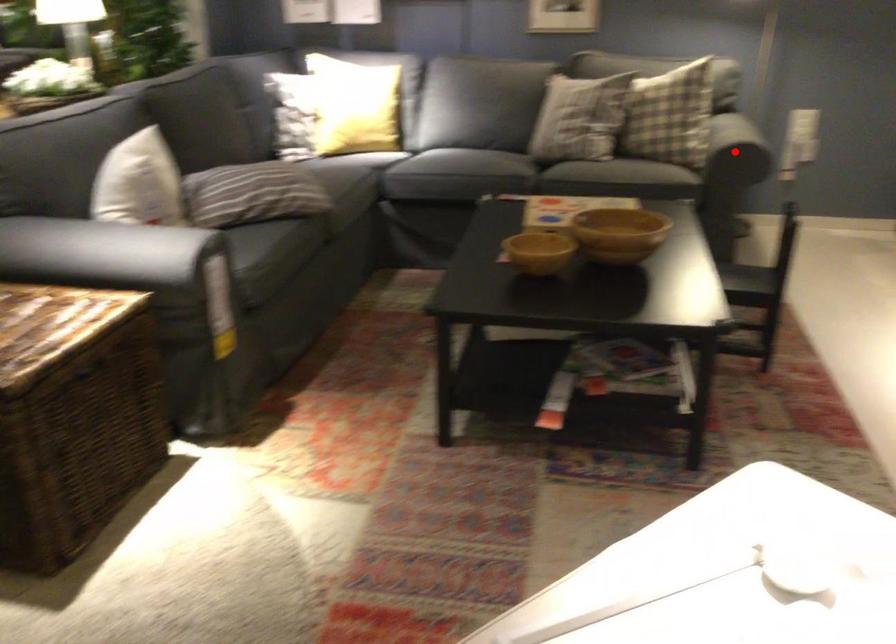
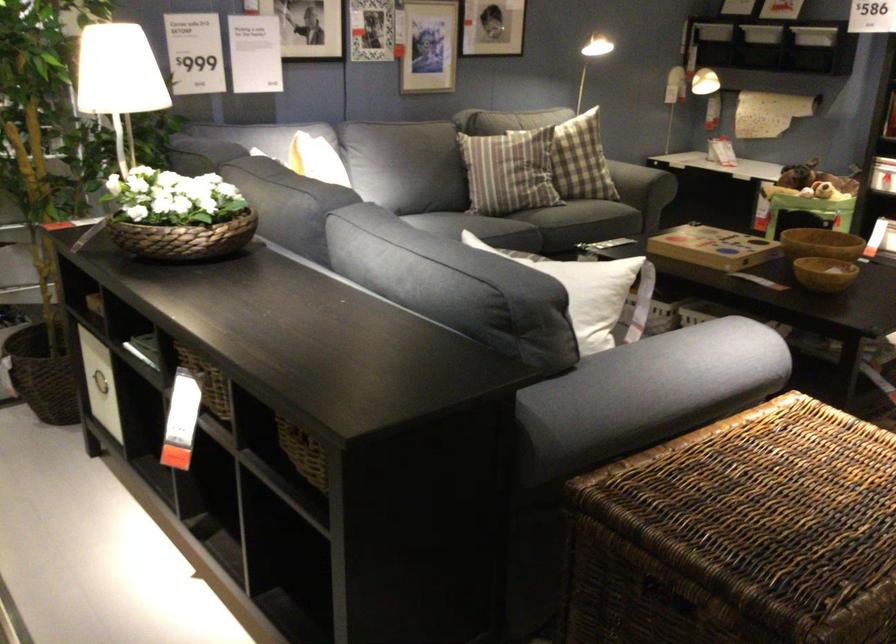
Question: I am providing you with two images of the same scene from different viewpoints. A red point is marked on the first image. Is the red point's position out of view in image 2?

Choices:
 (A) Yes
 (B) No

Answer: (A)